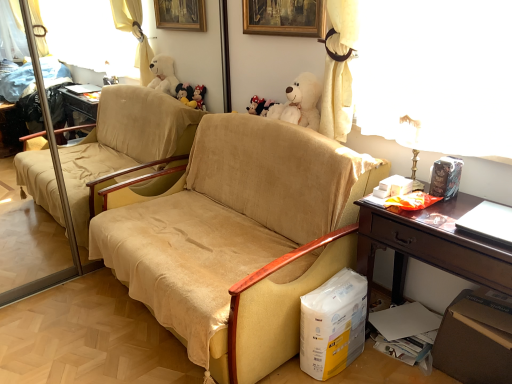
Question: Could white plush bear at upper center be considered to be inside beige fabric chair at center?

Choices:
 (A) yes
 (B) no

Answer: (A)

Question: Is beige fabric chair at center positioned beyond the bounds of white plush bear at upper center?

Choices:
 (A) no
 (B) yes

Answer: (B)

Question: From the image's perspective, is beige fabric chair at center on white plush bear at upper center?

Choices:
 (A) no
 (B) yes

Answer: (A)

Question: Considering the relative positions of beige fabric chair at center and white plush bear at upper center in the image provided, is beige fabric chair at center behind white plush bear at upper center?

Choices:
 (A) yes
 (B) no

Answer: (B)

Question: From the image's perspective, is beige fabric chair at center beneath white plush bear at upper center?

Choices:
 (A) no
 (B) yes

Answer: (B)

Question: From a real-world perspective, relative to beige fabric chair at center, is white plush bear at upper center vertically above or below?

Choices:
 (A) above
 (B) below

Answer: (A)

Question: Considering the positions of white plush bear at upper center and beige fabric chair at center in the image, is white plush bear at upper center taller or shorter than beige fabric chair at center?

Choices:
 (A) tall
 (B) short

Answer: (B)

Question: Is white plush bear at upper center to the left or to the right of beige fabric chair at center in the image?

Choices:
 (A) left
 (B) right

Answer: (B)

Question: Do you think white plush bear at upper center is within beige fabric chair at center, or outside of it?

Choices:
 (A) inside
 (B) outside

Answer: (A)

Question: From the image's perspective, is beige fabric chair at center positioned above or below white plush bear at upper center?

Choices:
 (A) above
 (B) below

Answer: (B)

Question: In terms of width, does beige fabric chair at center look wider or thinner when compared to white plush bear at upper center?

Choices:
 (A) thin
 (B) wide

Answer: (B)

Question: Considering the positions of beige fabric chair at center and white plush bear at upper center in the image, is beige fabric chair at center bigger or smaller than white plush bear at upper center?

Choices:
 (A) big
 (B) small

Answer: (A)

Question: From their relative heights in the image, would you say beige fabric chair at center is taller or shorter than white plush bear at upper center?

Choices:
 (A) short
 (B) tall

Answer: (B)

Question: In terms of width, does brown wooden desk at right look wider or thinner when compared to beige fabric chair at center?

Choices:
 (A) thin
 (B) wide

Answer: (A)

Question: Does point (442, 342) appear closer or farther from the camera than point (261, 362)?

Choices:
 (A) closer
 (B) farther

Answer: (B)